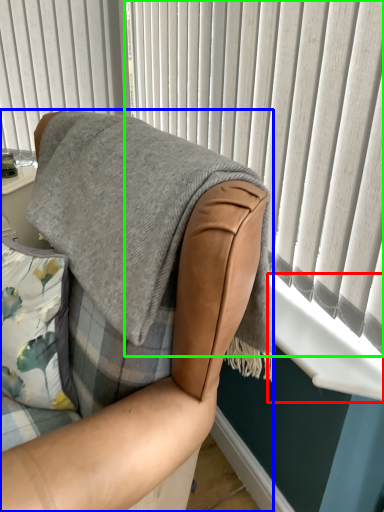
Question: Considering the real-world distances, which object is closest to window sill (highlighted by a red box)? chair (highlighted by a blue box) or curtain (highlighted by a green box).

Choices:
 (A) chair
 (B) curtain

Answer: (B)